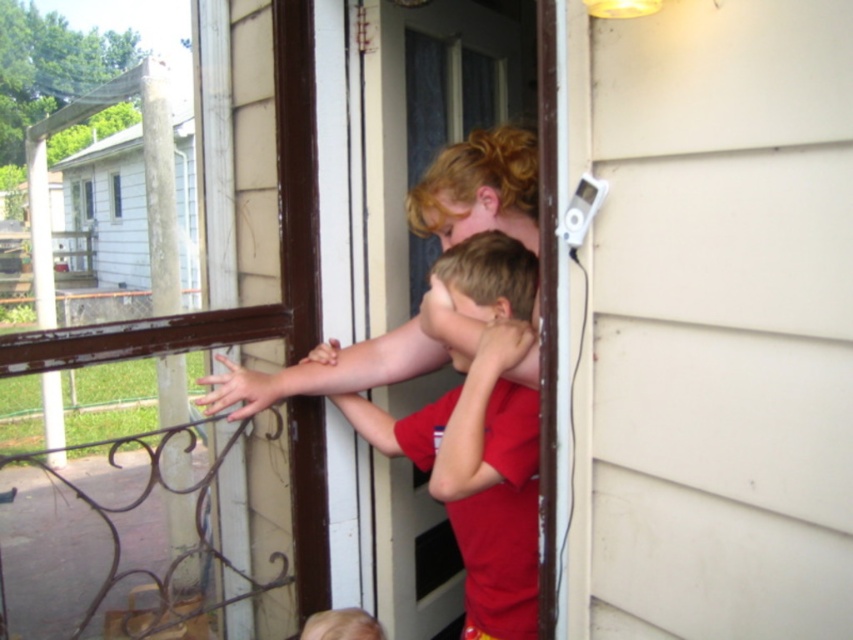
Question: Is white plastic screen door at upper right above transparent plastic screen door at center?

Choices:
 (A) yes
 (B) no

Answer: (B)

Question: Which point appears closest to the camera in this image?

Choices:
 (A) (538, 376)
 (B) (714, 45)

Answer: (B)

Question: Is white plastic screen door at upper right to the right of transparent plastic screen door at center from the viewer's perspective?

Choices:
 (A) no
 (B) yes

Answer: (B)

Question: Is white plastic screen door at upper right thinner than transparent plastic screen door at center?

Choices:
 (A) yes
 (B) no

Answer: (A)